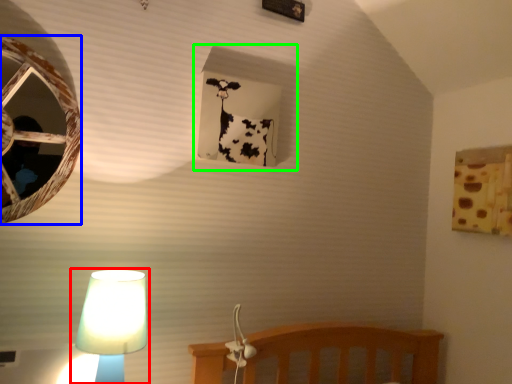
Question: Considering the real-world distances, which object is closest to lamp (highlighted by a red box)? oval (highlighted by a blue box) or window frame (highlighted by a green box).

Choices:
 (A) oval
 (B) window frame

Answer: (A)